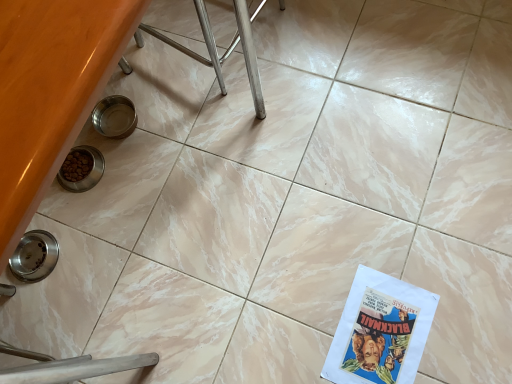
This screenshot has width=512, height=384. Find the location of `brushed metal stool at upper center`. brushed metal stool at upper center is located at coordinates (216, 49).

What do you see at coordinates (216, 49) in the screenshot?
I see `brushed metal stool at upper center` at bounding box center [216, 49].

The image size is (512, 384). What do you see at coordinates (380, 330) in the screenshot? I see `matte paper comic book at lower right` at bounding box center [380, 330].

Find the location of `matte paper comic book at lower right`. matte paper comic book at lower right is located at coordinates (380, 330).

Find the location of a particular element. This screenshot has height=384, width=512. brushed metal stool at upper center is located at coordinates (x=216, y=49).

Would you say brushed metal stool at upper center is to the left or to the right of matte paper comic book at lower right in the picture?

Based on their positions, brushed metal stool at upper center is located to the left of matte paper comic book at lower right.

Is brushed metal stool at upper center further to the viewer compared to matte paper comic book at lower right?

No, brushed metal stool at upper center is closer to the camera.

Which is closer, (x=219, y=64) or (x=389, y=301)?

The point (x=389, y=301) is more forward.

From the image's perspective, is brushed metal stool at upper center located above matte paper comic book at lower right?

Yes, from the image's perspective, brushed metal stool at upper center is on top of matte paper comic book at lower right.

From a real-world perspective, is brushed metal stool at upper center over matte paper comic book at lower right?

Yes, from a real-world perspective, brushed metal stool at upper center is on top of matte paper comic book at lower right.

Between brushed metal stool at upper center and matte paper comic book at lower right, which one has smaller width?

matte paper comic book at lower right.

Considering the relative sizes of brushed metal stool at upper center and matte paper comic book at lower right in the image provided, is brushed metal stool at upper center taller than matte paper comic book at lower right?

Yes, brushed metal stool at upper center is taller than matte paper comic book at lower right.

Can you confirm if brushed metal stool at upper center is bigger than matte paper comic book at lower right?

Yes.

Is brushed metal stool at upper center outside of matte paper comic book at lower right?

That's correct, brushed metal stool at upper center is outside of matte paper comic book at lower right.

Is brushed metal stool at upper center placed right next to matte paper comic book at lower right?

brushed metal stool at upper center and matte paper comic book at lower right are not in contact.

Could you tell me if brushed metal stool at upper center is turned towards matte paper comic book at lower right?

No.

Where is `comic book below the brushed metal stool at upper center (from a real-world perspective)`? The image size is (512, 384). comic book below the brushed metal stool at upper center (from a real-world perspective) is located at coordinates (380, 330).

In the scene shown: Does matte paper comic book at lower right appear on the right side of brushed metal stool at upper center?

Indeed, matte paper comic book at lower right is positioned on the right side of brushed metal stool at upper center.

Relative to brushed metal stool at upper center, is matte paper comic book at lower right in front or behind?

Clearly, matte paper comic book at lower right is behind brushed metal stool at upper center.

Which is closer, [346,370] or [225,52]?

The point [346,370] is in front.

From the image's perspective, which is below, matte paper comic book at lower right or brushed metal stool at upper center?

matte paper comic book at lower right appears lower in the image.

From a real-world perspective, which is physically above, matte paper comic book at lower right or brushed metal stool at upper center?

brushed metal stool at upper center is physically above.

Which of these two, matte paper comic book at lower right or brushed metal stool at upper center, is wider?

With larger width is brushed metal stool at upper center.

Considering the sizes of objects matte paper comic book at lower right and brushed metal stool at upper center in the image provided, who is shorter, matte paper comic book at lower right or brushed metal stool at upper center?

matte paper comic book at lower right.

In the scene shown: Can you confirm if matte paper comic book at lower right is smaller than brushed metal stool at upper center?

Indeed, matte paper comic book at lower right has a smaller size compared to brushed metal stool at upper center.

Would you say matte paper comic book at lower right is outside brushed metal stool at upper center?

Yes, matte paper comic book at lower right is not within brushed metal stool at upper center.

Is matte paper comic book at lower right positioned far away from brushed metal stool at upper center?

No, matte paper comic book at lower right is in close proximity to brushed metal stool at upper center.

Does matte paper comic book at lower right turn towards brushed metal stool at upper center?

No.

Based on the photo, measure the distance between matte paper comic book at lower right and brushed metal stool at upper center.

28.76 inches.

You are a GUI agent. You are given a task and a screenshot of the screen. Output one action in this format:
    pyautogui.click(x=<x>, y=<y>)
    Task: Click on the comic book that is below the brushed metal stool at upper center (from the image's perspective)
    
    Given the screenshot: What is the action you would take?
    pyautogui.click(x=380, y=330)

Find the location of a particular element. comic book below the brushed metal stool at upper center (from a real-world perspective) is located at coordinates (380, 330).

What are the coordinates of `furniture positioned vertically above the matte paper comic book at lower right (from a real-world perspective)` in the screenshot? It's located at (216, 49).